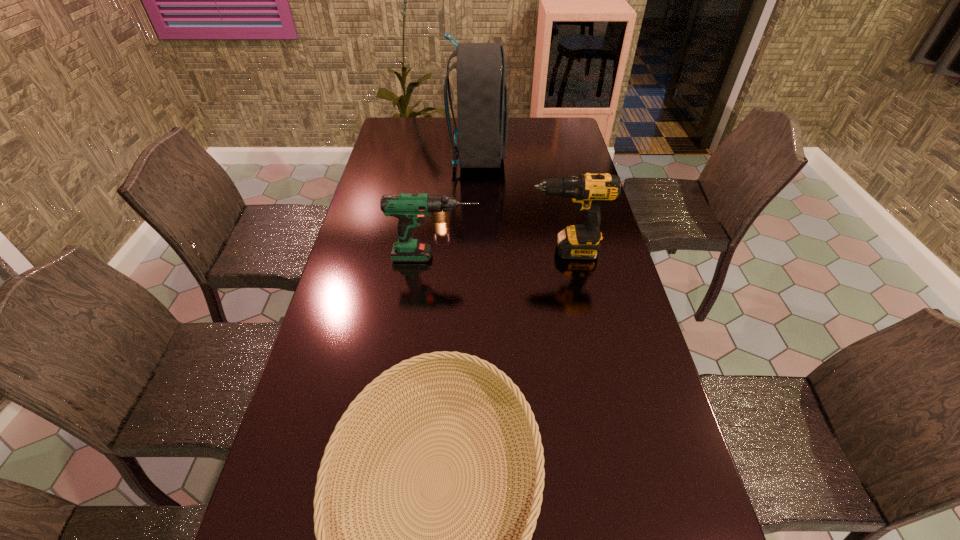
The image size is (960, 540). What are the coordinates of `vacant space situated on the handle side of the third shortest object` in the screenshot? It's located at pyautogui.click(x=500, y=257).

The image size is (960, 540). Identify the location of vacant position located on the front-facing side of the padlock. 437,252.

Find the location of a particular element. This screenshot has height=540, width=960. object at the far edge is located at coordinates (482, 96).

You are a GUI agent. You are given a task and a screenshot of the screen. Output one action in this format:
    pyautogui.click(x=<x>, y=<y>)
    Task: Click on the object present at the left edge
    Image resolution: width=960 pixels, height=540 pixels.
    Given the screenshot: What is the action you would take?
    pyautogui.click(x=410, y=209)

Where is `object that is at the right edge`? This screenshot has height=540, width=960. object that is at the right edge is located at coordinates (589, 191).

You are a GUI agent. You are given a task and a screenshot of the screen. Output one action in this format:
    pyautogui.click(x=<x>, y=<y>)
    Task: Click on the vacant space at the far edge of the desktop
    The width and height of the screenshot is (960, 540).
    Given the screenshot: What is the action you would take?
    pyautogui.click(x=435, y=130)

Find the location of `vacant region at the left edge`. vacant region at the left edge is located at coordinates point(314,453).

The image size is (960, 540). In order to click on free space at the right edge of the desktop in this screenshot , I will do `click(558, 151)`.

In the image, there is a desktop. Find the location of `vacant space at the far left corner`. vacant space at the far left corner is located at coordinates (419, 122).

What are the coordinates of `free space between the right drill and the backpack` in the screenshot? It's located at (522, 204).